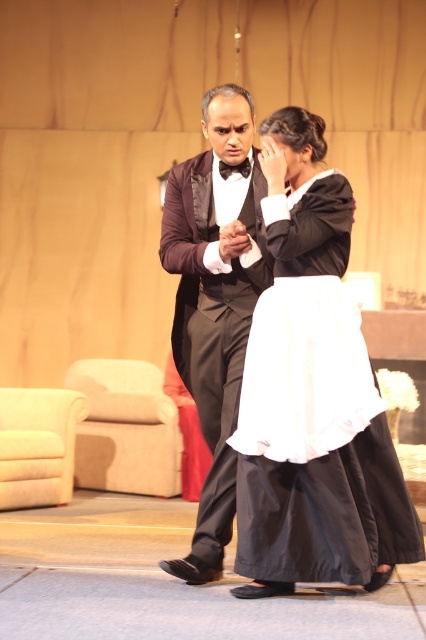
Based on the scene description, which object is positioned lower in the image between the matte black dress at center and the black satin bow tie at center?

The matte black dress at center is located below the black satin bow tie at center, so the matte black dress at center is positioned lower in the image.

Based on the scene description, which object is bigger between the shiny black tuxedo at center and the black satin bow tie at center?

The shiny black tuxedo at center is larger in size than the black satin bow tie at center according to the description.